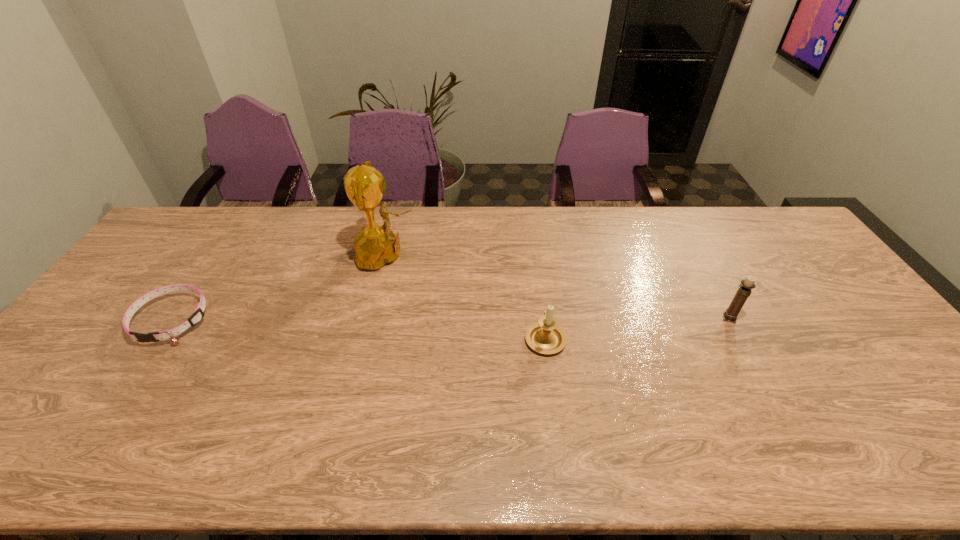
Identify the location of the second object from left to right. (376, 245).

Where is `award`? The height and width of the screenshot is (540, 960). award is located at coordinates pos(376,245).

In order to click on the right candle holder in this screenshot , I will do `click(745, 288)`.

At what (x,y) coordinates should I click in order to perform the action: click on the shorter candle holder. Please return your answer as a coordinate pair (x, y). Looking at the image, I should click on (546, 337).

In order to click on the third object from left to right in this screenshot , I will do `click(546, 337)`.

Locate an element on the screen. dog collar is located at coordinates click(x=197, y=316).

Where is `the shortest object`? Image resolution: width=960 pixels, height=540 pixels. the shortest object is located at coordinates (197, 316).

Identify the location of free region located on the front side of the farthest object. (492, 255).

This screenshot has width=960, height=540. Find the location of `vacant space situated 0.150m on the back of the right candle holder`. vacant space situated 0.150m on the back of the right candle holder is located at coordinates (707, 276).

You are a GUI agent. You are given a task and a screenshot of the screen. Output one action in this format:
    pyautogui.click(x=<x>, y=<y>)
    Task: Click on the free spot located with a handle on the side of the shorter candle holder
    This screenshot has width=960, height=540.
    Given the screenshot: What is the action you would take?
    pyautogui.click(x=535, y=264)